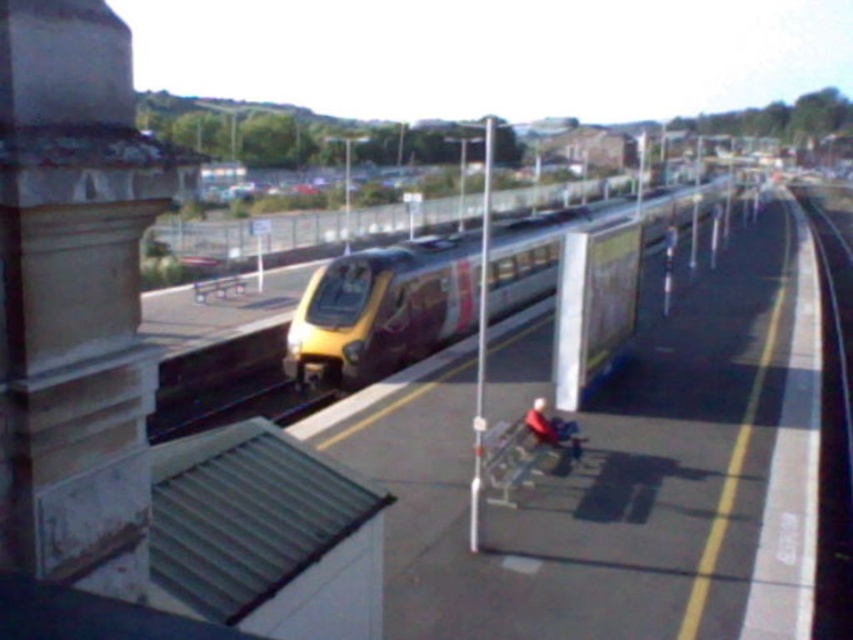
Where is `stone column at left`? The height and width of the screenshot is (640, 853). stone column at left is located at coordinates (73, 298).

Between stone column at left and black metal train track at lower left, which one is positioned higher?

stone column at left is higher up.

I want to click on stone column at left, so click(73, 298).

Who is shorter, yellow metallic train at center or black metal train track at lower left?

black metal train track at lower left is shorter.

Can you confirm if yellow metallic train at center is bigger than black metal train track at lower left?

Yes.

Does point (428, 272) come behind point (231, 401)?

Yes, it is.

Locate an element on the screen. The height and width of the screenshot is (640, 853). yellow metallic train at center is located at coordinates (383, 308).

Between point (90, 145) and point (607, 218), which one is positioned in front?

Positioned in front is point (90, 145).

Can you confirm if stone column at left is shorter than yellow metallic train at center?

Yes.

At what (x,y) coordinates should I click in order to perform the action: click on stone column at left. Please return your answer as a coordinate pair (x, y). Looking at the image, I should click on (73, 298).

In order to click on stone column at left in this screenshot , I will do `click(73, 298)`.